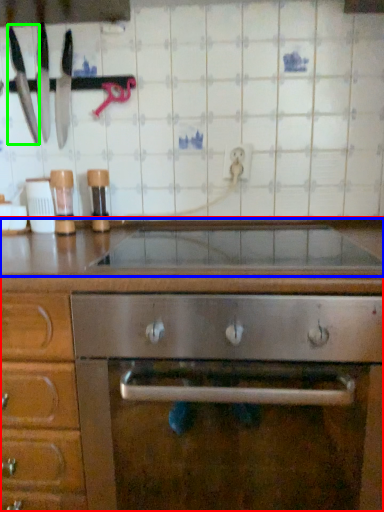
Question: Estimate the real-world distances between objects in this image. Which object is farther from cabinetry (highlighted by a red box), countertop (highlighted by a blue box) or kitchen appliance (highlighted by a green box)?

Choices:
 (A) countertop
 (B) kitchen appliance

Answer: (B)